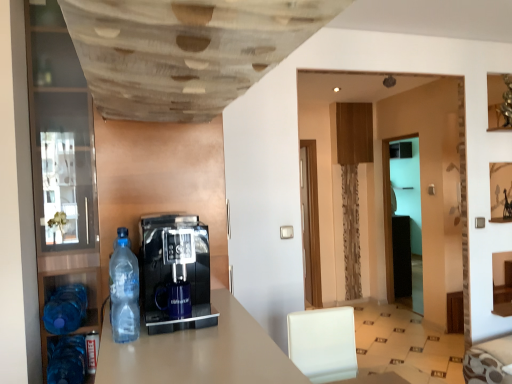
Question: Can you confirm if transparent glass door at center is bigger than transparent plastic bottle at left, positioned as the third bottle in left-to-right order?

Choices:
 (A) no
 (B) yes

Answer: (B)

Question: Is transparent glass door at center further to the viewer compared to transparent plastic bottle at left, positioned as the third bottle in left-to-right order?

Choices:
 (A) yes
 (B) no

Answer: (A)

Question: Does transparent glass door at center touch transparent plastic bottle at left, arranged as the 1th bottle when viewed from the top?

Choices:
 (A) yes
 (B) no

Answer: (B)

Question: From the image's perspective, does transparent glass door at center appear lower than transparent plastic bottle at left, acting as the 1th bottle starting from the right?

Choices:
 (A) yes
 (B) no

Answer: (A)

Question: Considering the relative sizes of transparent glass door at center and transparent plastic bottle at left, marked as the 3th bottle in a bottom-to-top arrangement, in the image provided, is transparent glass door at center wider than transparent plastic bottle at left, marked as the 3th bottle in a bottom-to-top arrangement,?

Choices:
 (A) yes
 (B) no

Answer: (A)

Question: In terms of size, does transparent glass door at center appear bigger or smaller than transparent glass pantry at left?

Choices:
 (A) big
 (B) small

Answer: (B)

Question: Looking at their shapes, would you say transparent glass door at center is wider or thinner than transparent glass pantry at left?

Choices:
 (A) thin
 (B) wide

Answer: (A)

Question: Do you think transparent glass door at center is within transparent glass pantry at left, or outside of it?

Choices:
 (A) outside
 (B) inside

Answer: (A)

Question: Is transparent glass door at center taller or shorter than transparent glass pantry at left?

Choices:
 (A) tall
 (B) short

Answer: (A)

Question: From their relative heights in the image, would you say blue plastic bottle at lower left, which ranks as the first bottle in left-to-right order, is taller or shorter than transparent plastic bottle at left, the 3th bottle from the back?

Choices:
 (A) tall
 (B) short

Answer: (B)

Question: In the image, is blue plastic bottle at lower left, the second bottle in the top-to-bottom sequence, on the left side or the right side of transparent plastic bottle at left, the 3th bottle from the back?

Choices:
 (A) right
 (B) left

Answer: (B)

Question: Is blue plastic bottle at lower left, which ranks as the first bottle in left-to-right order, inside the boundaries of transparent plastic bottle at left, marked as the 3th bottle in a bottom-to-top arrangement, or outside?

Choices:
 (A) outside
 (B) inside

Answer: (A)

Question: Considering the positions of point (60, 309) and point (115, 269), is point (60, 309) closer or farther from the camera than point (115, 269)?

Choices:
 (A) farther
 (B) closer

Answer: (A)

Question: Is transparent glass door at center inside the boundaries of blue plastic bottle at lower left, placed as the second bottle when sorted from bottom to top, or outside?

Choices:
 (A) outside
 (B) inside

Answer: (A)

Question: Is transparent glass door at center in front of or behind blue plastic bottle at lower left, the 3th bottle viewed from the right, in the image?

Choices:
 (A) front
 (B) behind

Answer: (B)